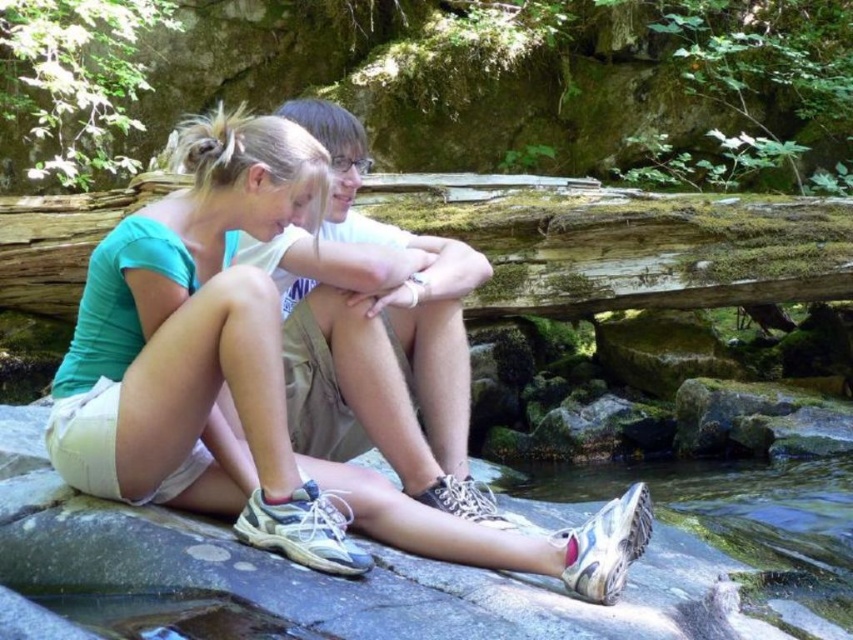
Question: Based on their relative distances, which object is farther from the white rubber shoe at lower center?

Choices:
 (A) matte white shorts at center
 (B) weathered wood log at center

Answer: (A)

Question: Can you confirm if matte white shorts at center is thinner than white rubber shoe at lower center?

Choices:
 (A) yes
 (B) no

Answer: (B)

Question: Does matte white shorts at center have a lesser width compared to white rubber shoe at lower center?

Choices:
 (A) yes
 (B) no

Answer: (B)

Question: Can you confirm if weathered wood log at center is positioned above white rubber shoe at lower center?

Choices:
 (A) yes
 (B) no

Answer: (A)

Question: Which point is farther to the camera?

Choices:
 (A) (198, 454)
 (B) (62, 308)
 (C) (538, 468)

Answer: (B)

Question: Among these objects, which one is nearest to the camera?

Choices:
 (A) matte white shorts at center
 (B) weathered wood log at center

Answer: (A)